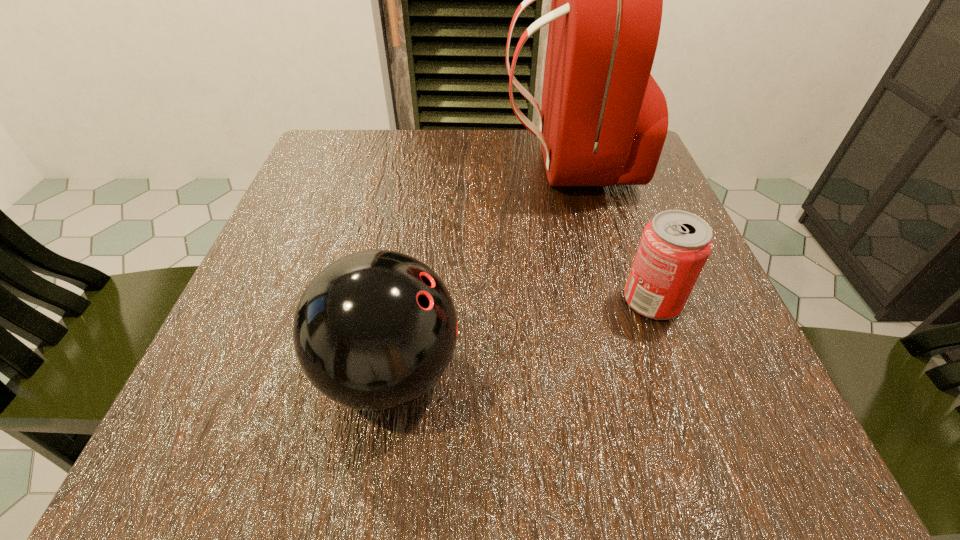
This screenshot has height=540, width=960. Identify the location of free space at the right edge of the desktop. (639, 203).

Where is `vacant space at the far left corner of the desktop`? vacant space at the far left corner of the desktop is located at coordinates (x=327, y=131).

What are the coordinates of `vacant space at the far right corner of the desktop` in the screenshot? It's located at (656, 183).

At what (x,y) coordinates should I click in order to perform the action: click on vacant space that's between the second tallest object and the tallest object. Please return your answer as a coordinate pair (x, y). Looking at the image, I should click on (478, 268).

Find the location of `free space between the farthest object and the leftmost object`. free space between the farthest object and the leftmost object is located at coordinates (478, 268).

At what (x,y) coordinates should I click in order to perform the action: click on vacant space that is in between the backpack and the shortest object. Please return your answer as a coordinate pair (x, y). The width and height of the screenshot is (960, 540). Looking at the image, I should click on (610, 232).

Locate an element on the screen. Image resolution: width=960 pixels, height=540 pixels. empty location between the bowling ball and the shortest object is located at coordinates (521, 336).

Find the location of a particular element. free spot between the tallest object and the shortest object is located at coordinates (610, 232).

Image resolution: width=960 pixels, height=540 pixels. I want to click on unoccupied area between the leftmost object and the shortest object, so (x=521, y=336).

The height and width of the screenshot is (540, 960). I want to click on vacant area between the bowling ball and the farthest object, so click(478, 268).